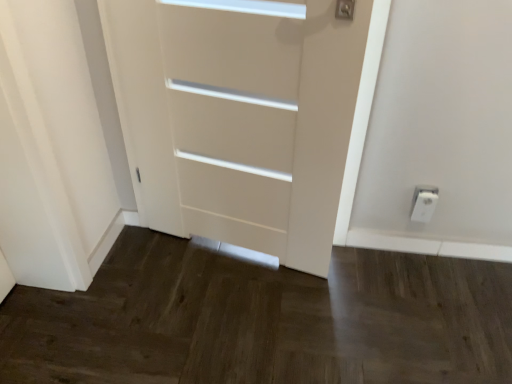
Question: Is white matte door at center turned away from white plastic electric outlet at lower right?

Choices:
 (A) yes
 (B) no

Answer: (B)

Question: From the image's perspective, is white matte door at center under white plastic electric outlet at lower right?

Choices:
 (A) no
 (B) yes

Answer: (A)

Question: Can you confirm if white matte door at center is positioned to the left of white plastic electric outlet at lower right?

Choices:
 (A) yes
 (B) no

Answer: (A)

Question: Does white matte door at center appear on the right side of white plastic electric outlet at lower right?

Choices:
 (A) no
 (B) yes

Answer: (A)

Question: Could you tell me if white matte door at center is turned towards white plastic electric outlet at lower right?

Choices:
 (A) no
 (B) yes

Answer: (A)

Question: Considering the relative sizes of white matte door at center and white plastic electric outlet at lower right in the image provided, is white matte door at center bigger than white plastic electric outlet at lower right?

Choices:
 (A) yes
 (B) no

Answer: (A)

Question: Can you confirm if white plastic electric outlet at lower right is positioned to the left of white matte door at center?

Choices:
 (A) no
 (B) yes

Answer: (A)

Question: Considering the relative sizes of white plastic electric outlet at lower right and white matte door at center in the image provided, is white plastic electric outlet at lower right wider than white matte door at center?

Choices:
 (A) yes
 (B) no

Answer: (B)

Question: Is white plastic electric outlet at lower right facing towards white matte door at center?

Choices:
 (A) no
 (B) yes

Answer: (A)

Question: From the image's perspective, is white plastic electric outlet at lower right on top of white matte door at center?

Choices:
 (A) no
 (B) yes

Answer: (A)

Question: Does white plastic electric outlet at lower right appear on the right side of white matte door at center?

Choices:
 (A) no
 (B) yes

Answer: (B)

Question: Is white plastic electric outlet at lower right shorter than white matte door at center?

Choices:
 (A) yes
 (B) no

Answer: (A)

Question: From the image's perspective, is white matte door at center located above or below white plastic electric outlet at lower right?

Choices:
 (A) above
 (B) below

Answer: (A)